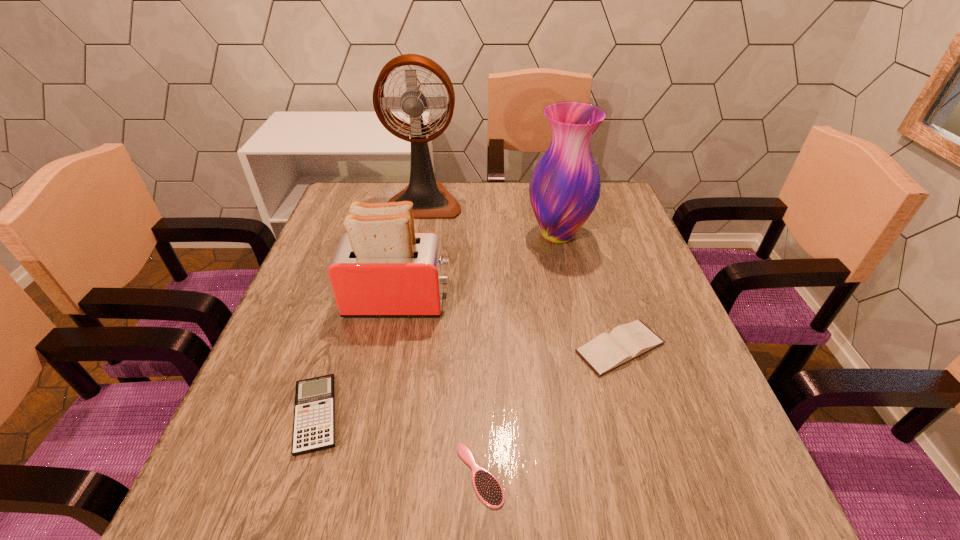
Where is `free point that satisfies the following two spatial constraints: 1. on the front-facing side of the third farthest object; 2. on the back side of the diary`? The height and width of the screenshot is (540, 960). free point that satisfies the following two spatial constraints: 1. on the front-facing side of the third farthest object; 2. on the back side of the diary is located at coordinates (390, 348).

Find the location of a particular element. vacant space that satisfies the following two spatial constraints: 1. on the front-facing side of the hairbrush; 2. on the left side of the tallest object is located at coordinates (373, 475).

Identify the location of free point that satisfies the following two spatial constraints: 1. on the front side of the fifth shortest object; 2. on the left side of the fourth farthest object. (584, 348).